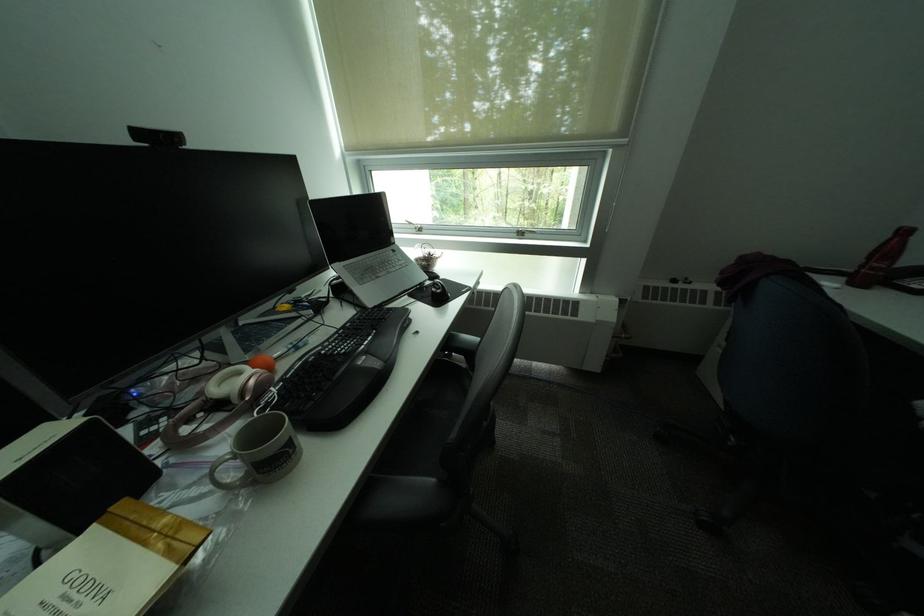
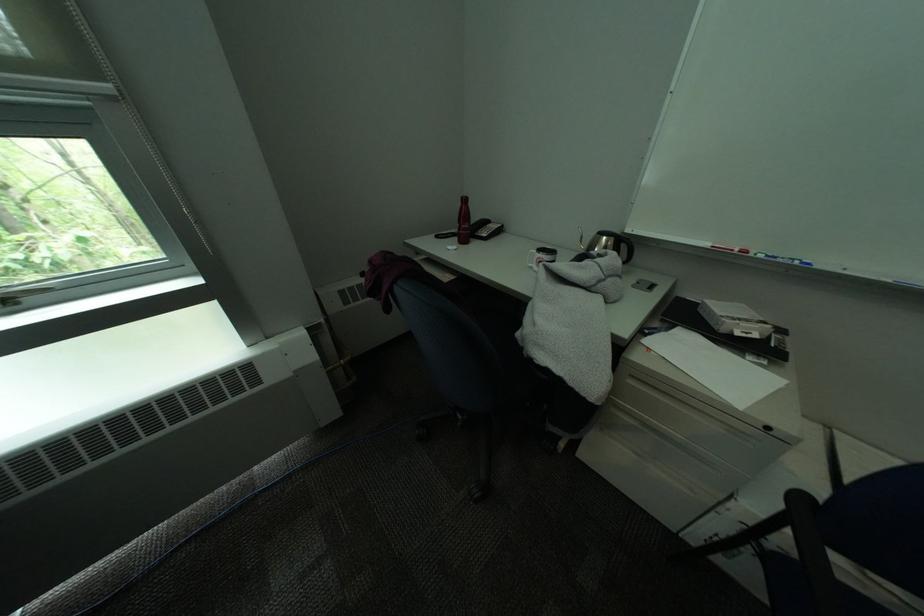
In the second image, find the point that corresponds to (637,140) in the first image.

(119, 87)